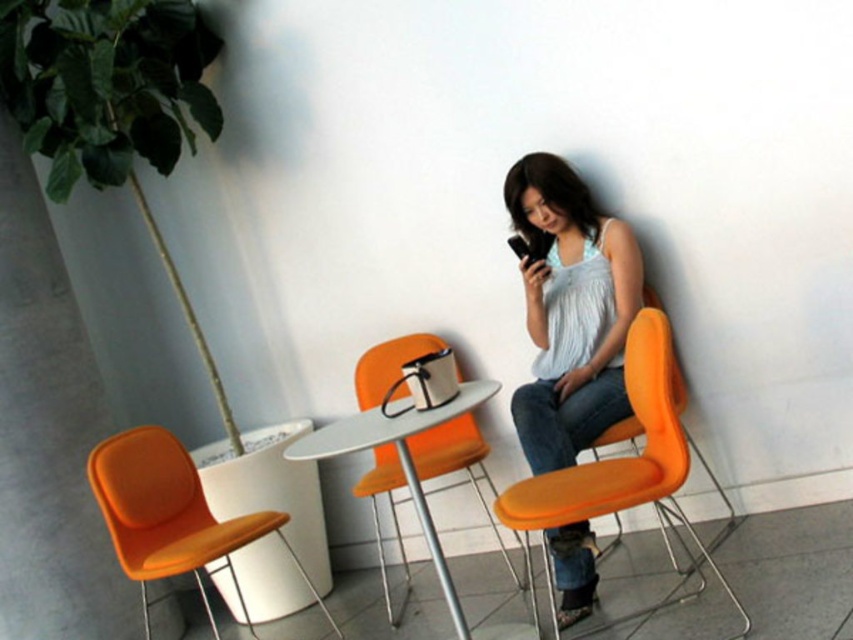
Question: From the image, what is the correct spatial relationship of matte white tank top at center in relation to orange fabric chair at left?

Choices:
 (A) above
 (B) below

Answer: (A)

Question: Does matte white tank top at center have a greater width compared to orange fabric chair at right?

Choices:
 (A) no
 (B) yes

Answer: (A)

Question: Which is farther from the matte white tank top at center?

Choices:
 (A) orange fabric chair at center
 (B) orange fabric chair at left
 (C) orange fabric chair at right

Answer: (B)

Question: Which point is farther to the camera?

Choices:
 (A) (155, 499)
 (B) (619, 364)
 (C) (631, 356)

Answer: (A)

Question: Which point is farther to the camera?

Choices:
 (A) orange fabric chair at left
 (B) orange fabric chair at right

Answer: (A)

Question: Does orange fabric chair at right appear under orange fabric chair at left?

Choices:
 (A) yes
 (B) no

Answer: (B)